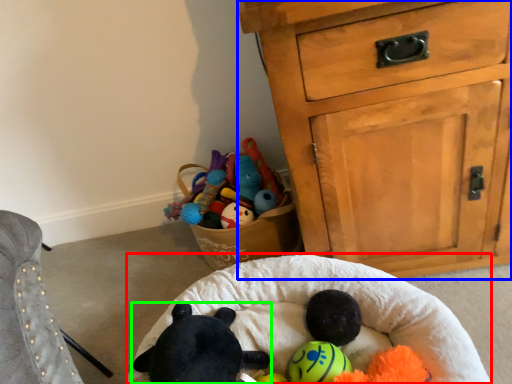
Question: Estimate the real-world distances between objects in this image. Which object is farther from infant bed (highlighted by a red box), chest of drawers (highlighted by a blue box) or toy (highlighted by a green box)?

Choices:
 (A) chest of drawers
 (B) toy

Answer: (A)